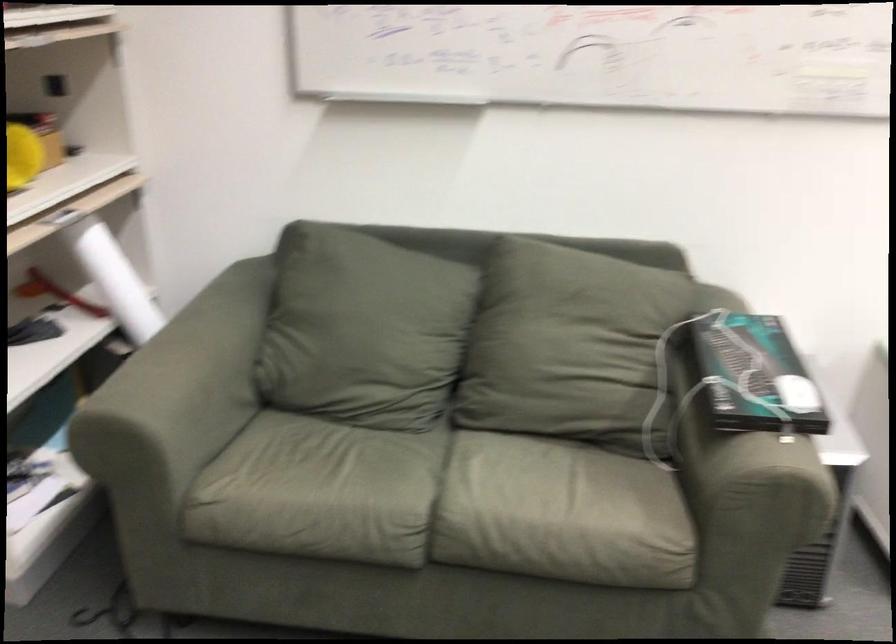
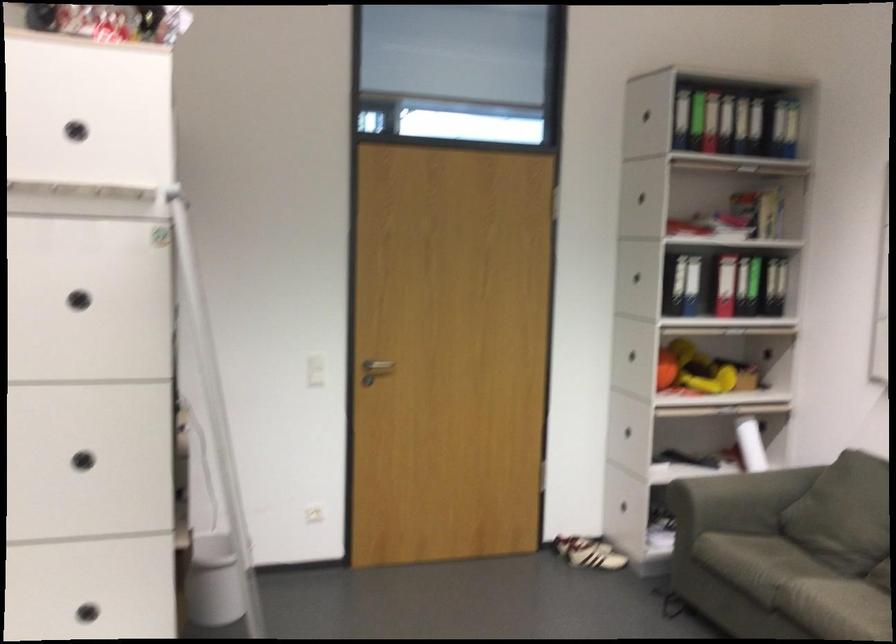
The point at (x=330, y=428) is marked in the first image. Where is the corresponding point in the second image?

(787, 550)